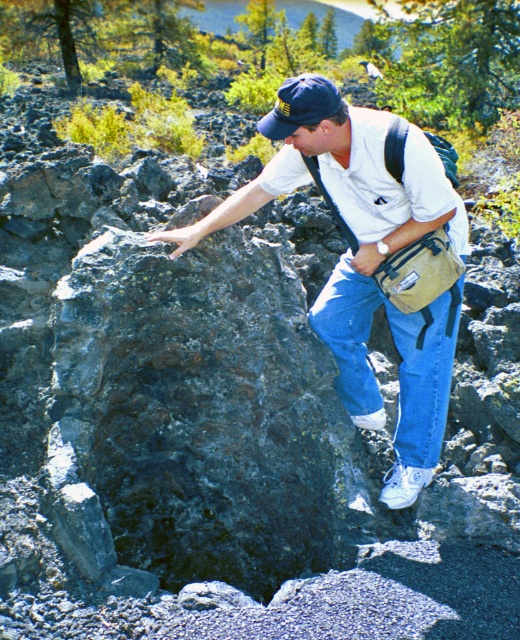
Between point (409, 125) and point (276, 124), which one is positioned in front?

Positioned in front is point (409, 125).

This screenshot has height=640, width=520. Describe the element at coordinates (372, 269) in the screenshot. I see `white cotton shirt at center` at that location.

Which is behind, point (433, 285) or point (321, 88)?

Positioned behind is point (433, 285).

The image size is (520, 640). I want to click on white cotton shirt at center, so click(372, 269).